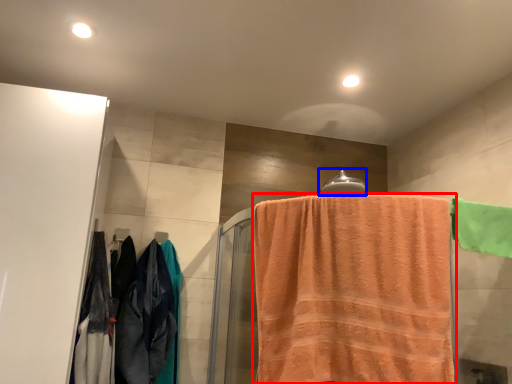
Question: Which object appears farthest to the camera in this image, towel (highlighted by a red box) or towel bar (highlighted by a blue box)?

Choices:
 (A) towel
 (B) towel bar

Answer: (B)